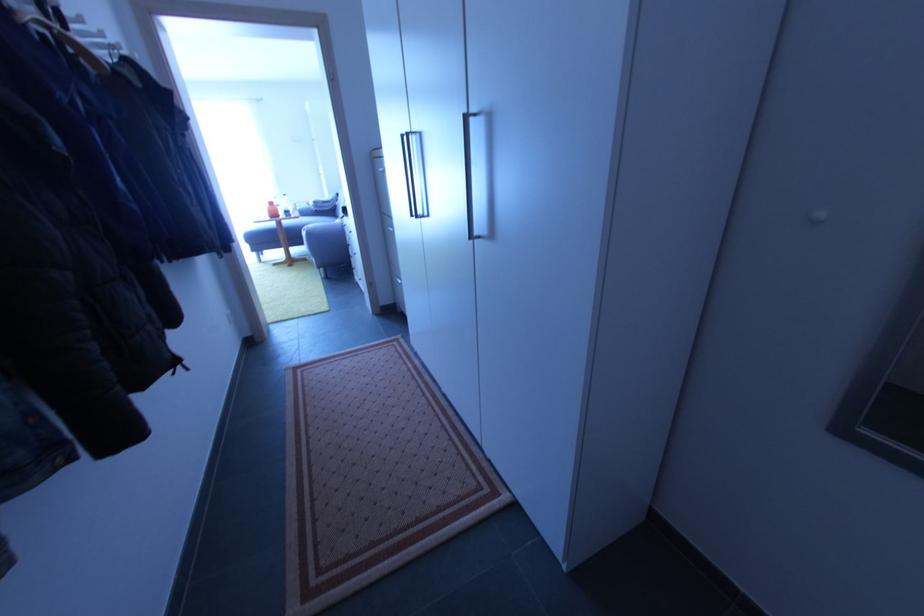
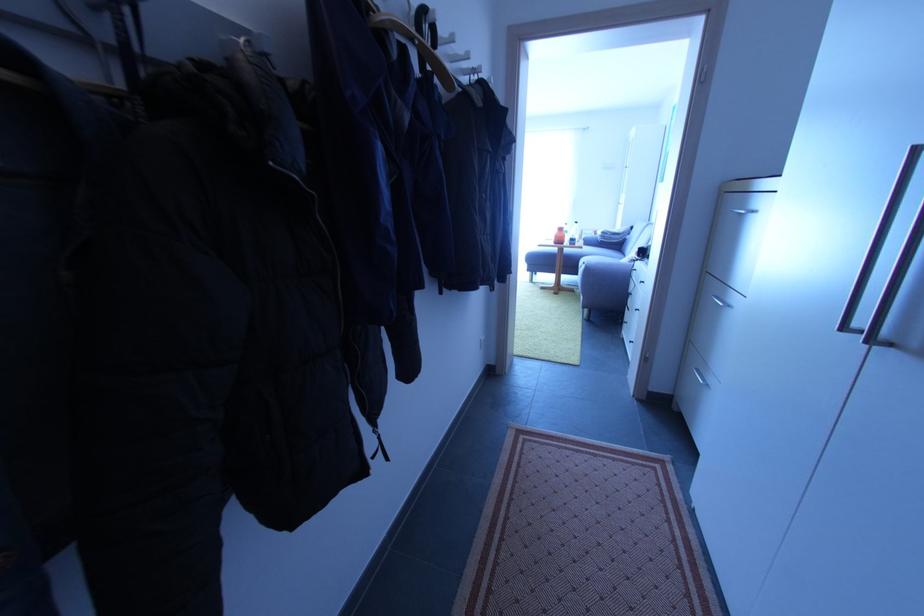
The point at (89, 65) is marked in the first image. Where is the corresponding point in the second image?

(441, 82)